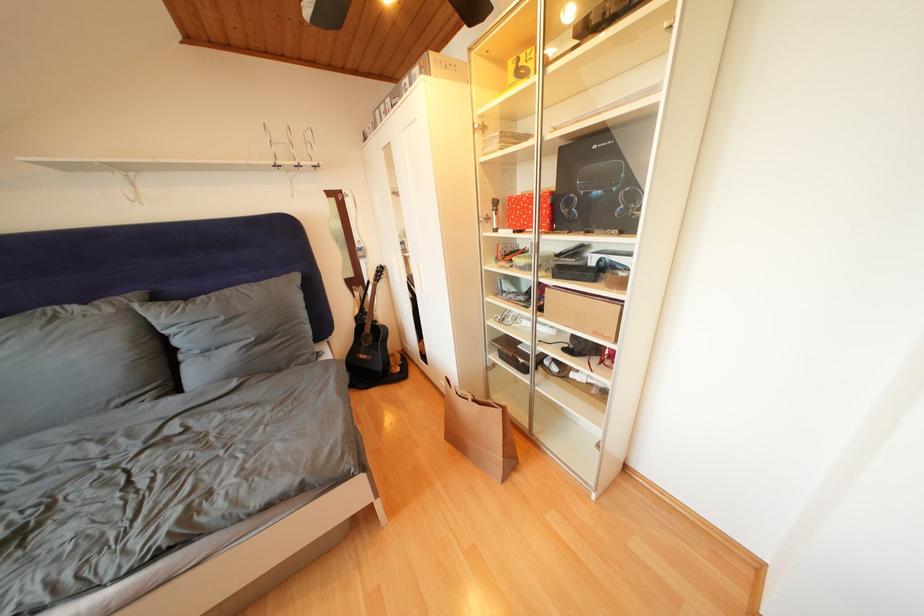
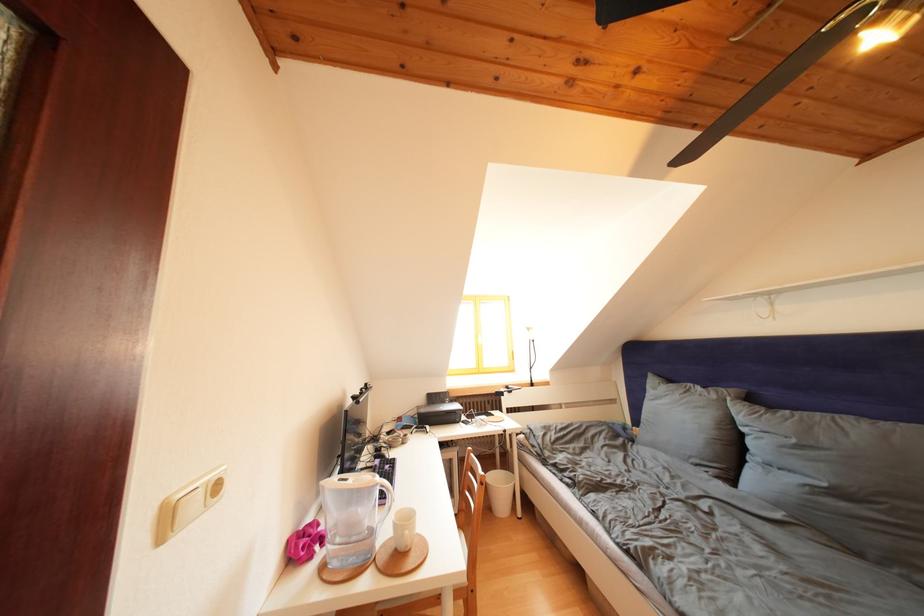
Find the pixel in the second image that matches (x=117, y=315) in the first image.

(722, 402)